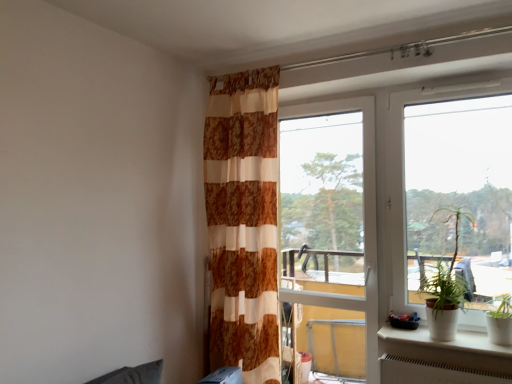
Question: Is brown textured curtain at center in front of or behind white ceramic pot at lower right in the image?

Choices:
 (A) front
 (B) behind

Answer: (B)

Question: Which is correct: brown textured curtain at center is inside white ceramic pot at lower right, or outside of it?

Choices:
 (A) inside
 (B) outside

Answer: (B)

Question: Estimate the real-world distances between objects in this image. Which object is farther from the transparent glass screen door at center?

Choices:
 (A) green leafy plant at right
 (B) transparent glass window at right
 (C) brown textured curtain at center
 (D) white ceramic pot at lower right

Answer: (D)

Question: Estimate the real-world distances between objects in this image. Which object is farther from the green leafy plant at right?

Choices:
 (A) transparent glass window at right
 (B) brown textured curtain at center
 (C) white ceramic pot at lower right
 (D) transparent glass screen door at center

Answer: (B)